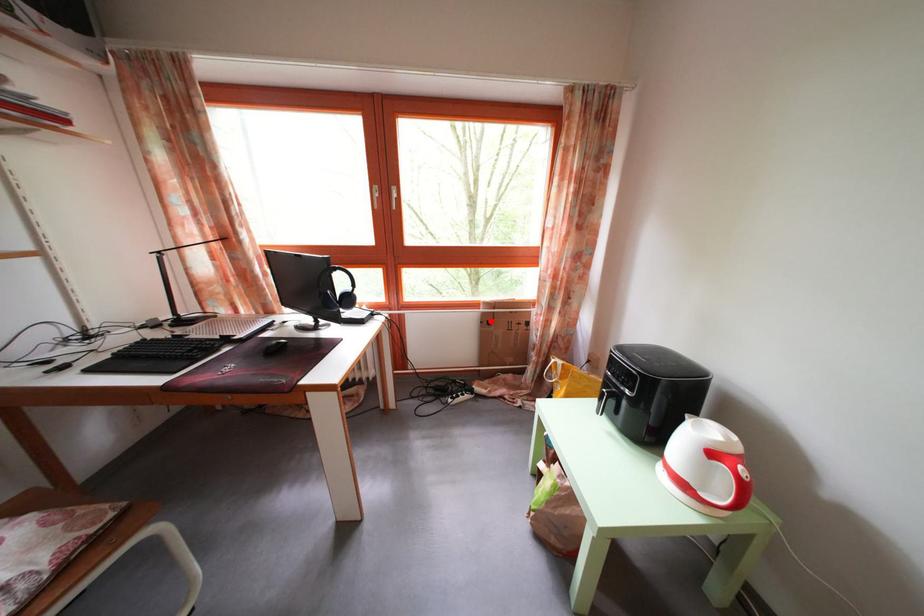
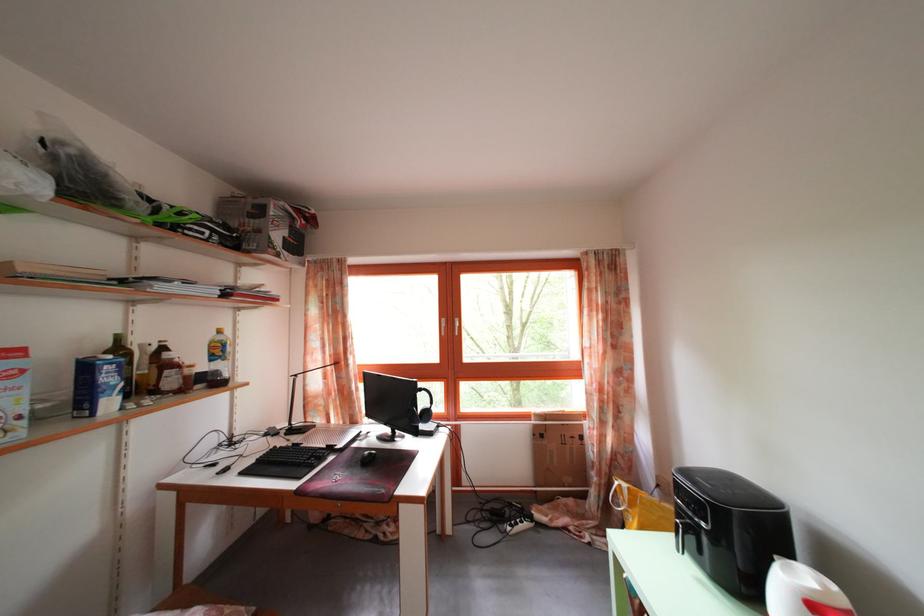
Where in the second image is the point corresponding to the highlighted location from the first image?

(542, 432)